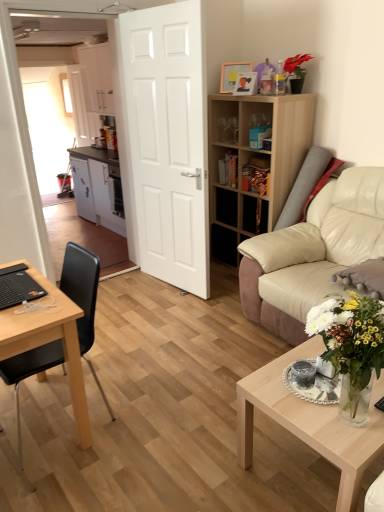
Identify the location of free spot in front of white matte door at center. The width and height of the screenshot is (384, 512). (159, 311).